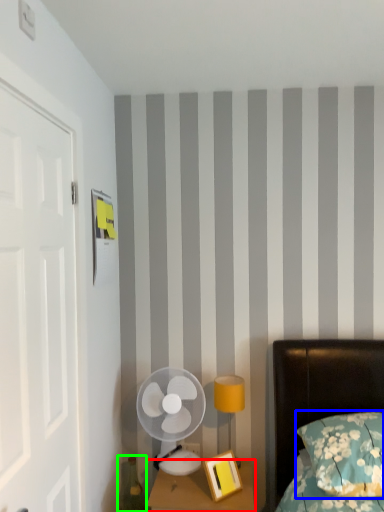
Question: Based on their relative distances, which object is farther from nightstand (highlighted by a red box)? Choose from pillow (highlighted by a blue box) and teal (highlighted by a green box).

Choices:
 (A) pillow
 (B) teal

Answer: (A)